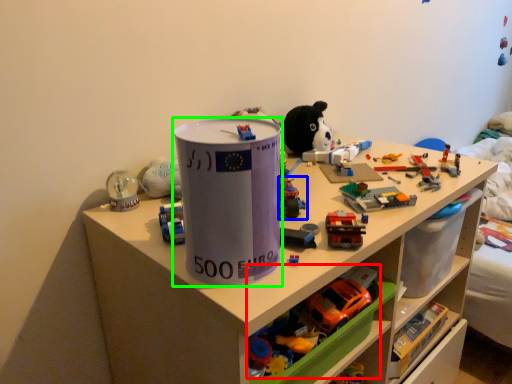
Question: Which is farther away from toy (highlighted by a red box)? toy (highlighted by a blue box) or paper cup (highlighted by a green box)?

Choices:
 (A) toy
 (B) paper cup

Answer: (B)